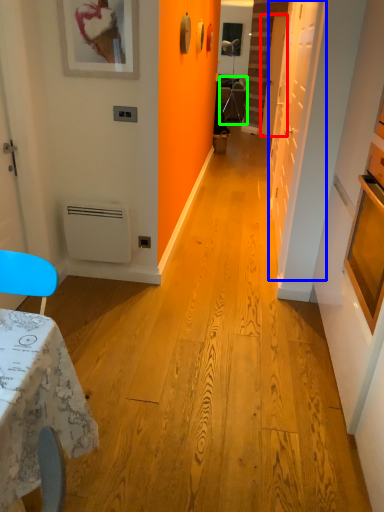
Question: Based on their relative distances, which object is nearer to door (highlighted by a red box)? Choose from door (highlighted by a blue box) and armchair (highlighted by a green box).

Choices:
 (A) door
 (B) armchair

Answer: (B)